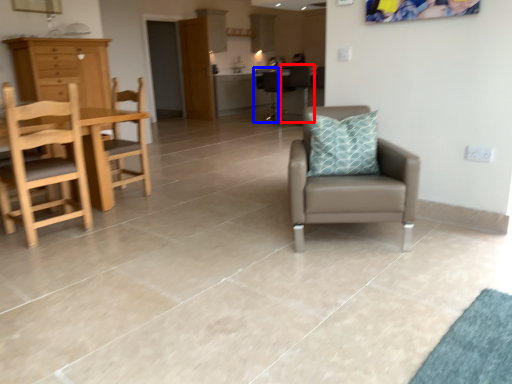
Question: Which of the following is the farthest to the observer, chair (highlighted by a red box) or armchair (highlighted by a blue box)?

Choices:
 (A) chair
 (B) armchair

Answer: (B)